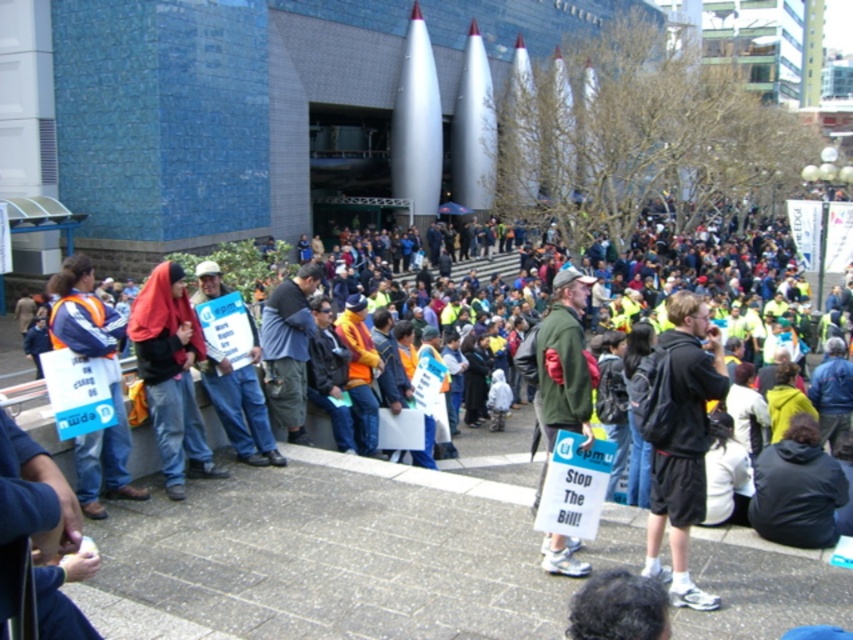
Question: Does black fabric backpack at right have a smaller size compared to orange safety vest at left?

Choices:
 (A) no
 (B) yes

Answer: (B)

Question: Which point appears closest to the camera in this image?

Choices:
 (A) (670, 468)
 (B) (573, 308)
 (C) (259, 404)
 (D) (171, 323)

Answer: (A)

Question: Is red fabric headscarf at center above orange safety vest at center?

Choices:
 (A) yes
 (B) no

Answer: (B)

Question: Considering the relative positions of red fabric headscarf at center and orange safety vest at center in the image provided, where is red fabric headscarf at center located with respect to orange safety vest at center?

Choices:
 (A) below
 (B) above

Answer: (A)

Question: Among these objects, which one is farthest from the camera?

Choices:
 (A) red fabric headscarf at center
 (B) green fabric jacket at center

Answer: (A)

Question: Which point appears closest to the camera in this image?

Choices:
 (A) (560, 545)
 (B) (112, 490)
 (C) (209, 298)

Answer: (A)